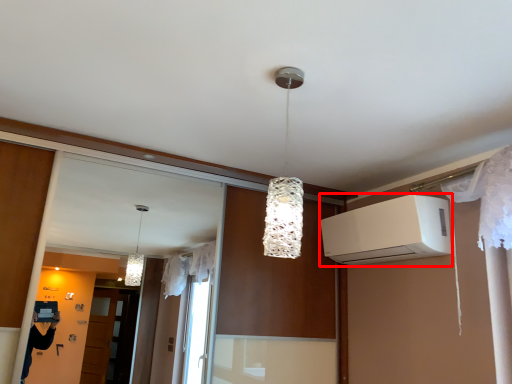
Question: From the image's perspective, what is the correct spatial relationship of air conditioning (annotated by the red box) in relation to lamp?

Choices:
 (A) above
 (B) below

Answer: (B)